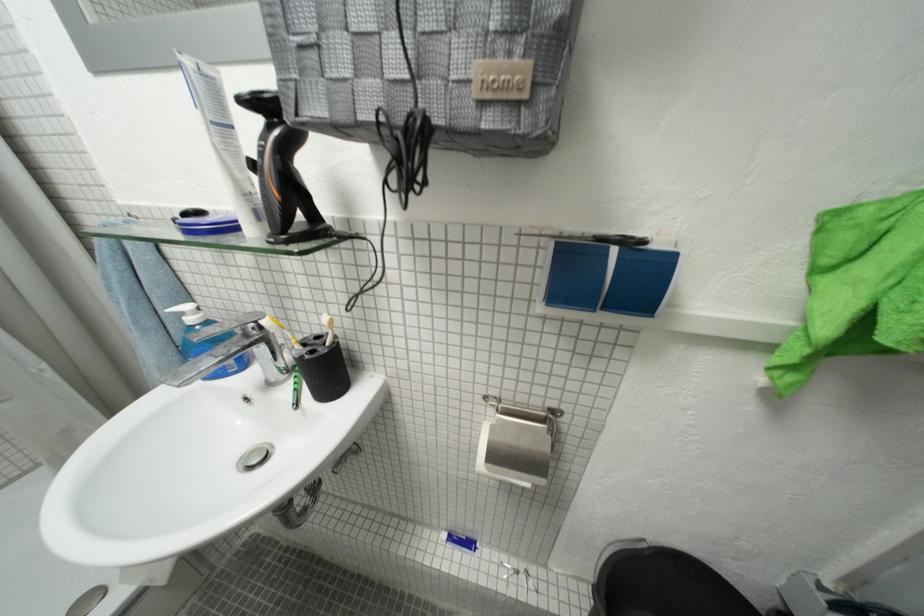
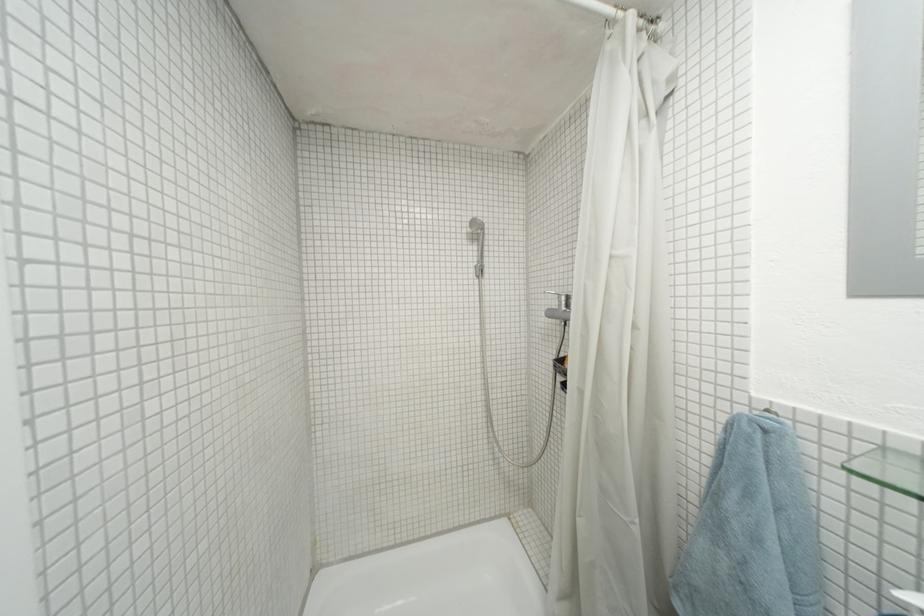
Question: The camera is either moving clockwise (left) or counter-clockwise (right) around the object. The first image is from the beginning of the video and the second image is from the end. Is the camera moving left or right when shooting the video?

Choices:
 (A) Left
 (B) Right

Answer: (B)